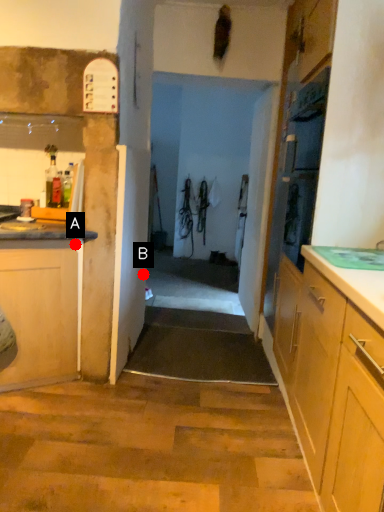
Question: Two points are circled on the image, labeled by A and B beside each circle. Which point appears farthest from the camera in this image?

Choices:
 (A) A is further
 (B) B is further

Answer: (B)